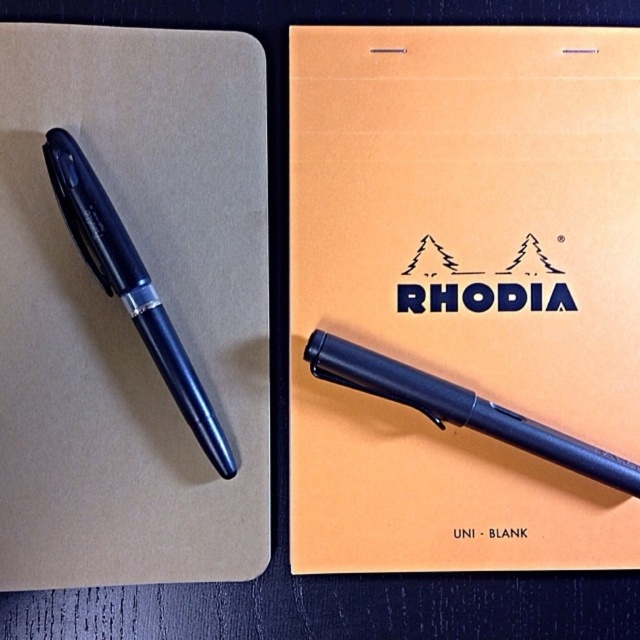
Question: Which object is positioned farthest from the orange matte paper at upper center?

Choices:
 (A) matte black pen at center
 (B) matte black pen at left

Answer: (B)

Question: From the image, what is the correct spatial relationship of orange matte paper at upper center in relation to matte black pen at left?

Choices:
 (A) above
 (B) below

Answer: (A)

Question: Is matte brown notepad at left further to camera compared to matte black pen at center?

Choices:
 (A) yes
 (B) no

Answer: (B)

Question: Which point is farther to the camera?

Choices:
 (A) matte black pen at left
 (B) matte brown notepad at left

Answer: (B)

Question: Among these points, which one is nearest to the camera?

Choices:
 (A) (58, 257)
 (B) (125, 285)

Answer: (B)

Question: Is matte brown notepad at left positioned at the back of matte black pen at left?

Choices:
 (A) yes
 (B) no

Answer: (A)